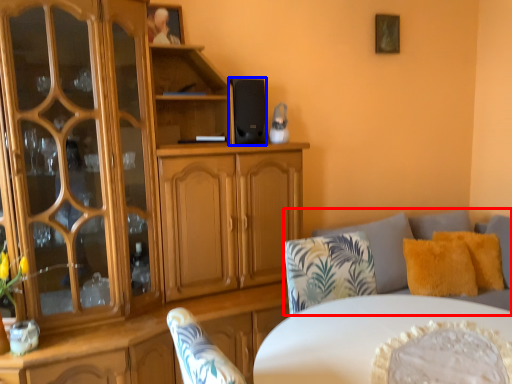
Question: Which of the following is the farthest to the observer, studio couch (highlighted by a red box) or speaker (highlighted by a blue box)?

Choices:
 (A) studio couch
 (B) speaker

Answer: (B)